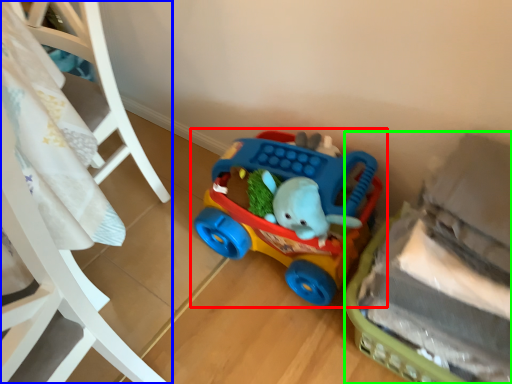
Question: Estimate the real-world distances between objects in this image. Which object is closer to toy (highlighted by a red box), furniture (highlighted by a blue box) or toy (highlighted by a green box)?

Choices:
 (A) furniture
 (B) toy

Answer: (B)